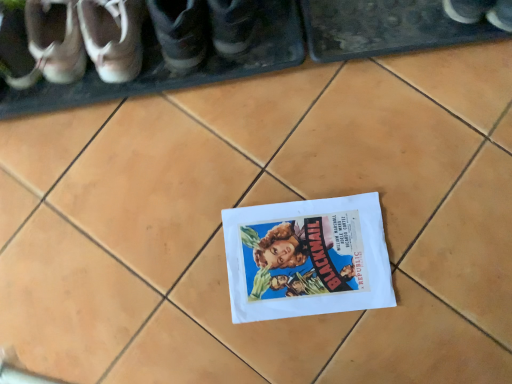
Locate an element on the screen. The width and height of the screenshot is (512, 384). vacant area on top of white paper flyer at center (from a real-world perspective) is located at coordinates (312, 257).